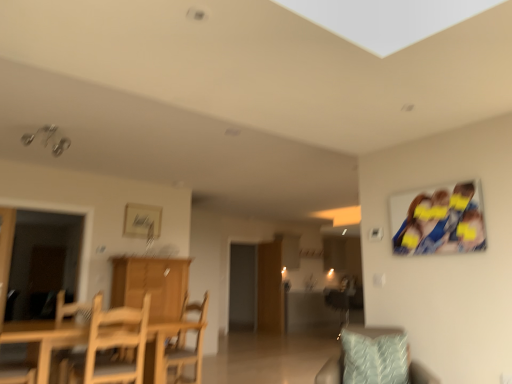
Question: Is there a large distance between wooden chair at center, which is the 3th chair in left-to-right order, and wooden chair at lower left?

Choices:
 (A) yes
 (B) no

Answer: (A)

Question: Is wooden chair at center, which is the third chair in front-to-back order, positioned with its back to wooden chair at lower left?

Choices:
 (A) no
 (B) yes

Answer: (A)

Question: Can you confirm if wooden chair at center, placed as the 2th chair when sorted from back to front, is shorter than wooden chair at lower left?

Choices:
 (A) yes
 (B) no

Answer: (B)

Question: Could you tell me if wooden chair at center, placed as the 2th chair when sorted from back to front, is facing wooden chair at lower left?

Choices:
 (A) no
 (B) yes

Answer: (B)

Question: From a real-world perspective, is wooden chair at center, which is the third chair in front-to-back order, located higher than wooden chair at lower left?

Choices:
 (A) no
 (B) yes

Answer: (A)

Question: Is wooden chair at center, which is the 3th chair in left-to-right order, thinner than wooden chair at lower left?

Choices:
 (A) no
 (B) yes

Answer: (A)

Question: From the image's perspective, is light wood table at lower left located above wooden chair at lower left?

Choices:
 (A) no
 (B) yes

Answer: (A)

Question: Is light wood table at lower left facing towards wooden chair at lower left?

Choices:
 (A) yes
 (B) no

Answer: (A)

Question: Is light wood table at lower left thinner than wooden chair at lower left?

Choices:
 (A) no
 (B) yes

Answer: (A)

Question: Considering the relative positions of light wood table at lower left and wooden chair at lower left in the image provided, is light wood table at lower left behind wooden chair at lower left?

Choices:
 (A) yes
 (B) no

Answer: (B)

Question: Is light wood table at lower left in contact with wooden chair at lower left?

Choices:
 (A) no
 (B) yes

Answer: (A)

Question: Would you say light wood table at lower left is a long distance from wooden chair at lower left?

Choices:
 (A) yes
 (B) no

Answer: (B)

Question: Considering the relative sizes of light blue textured pillow at lower right and matte silver picture frame at upper center in the image provided, is light blue textured pillow at lower right bigger than matte silver picture frame at upper center?

Choices:
 (A) yes
 (B) no

Answer: (A)